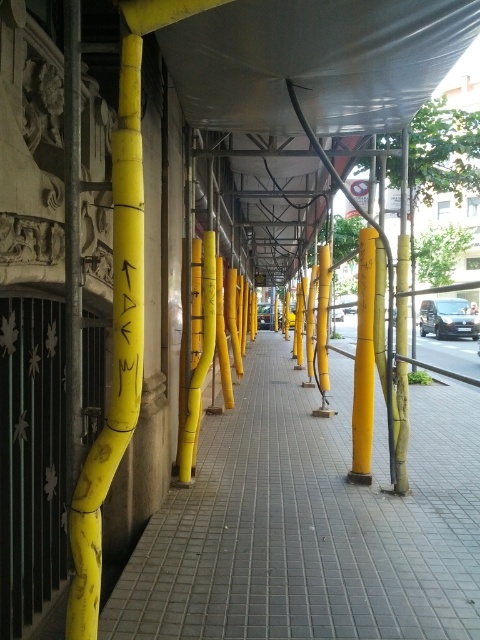
You are standing at the start of the walkway and see the yellow matte pole at center. If you walk straight towards it, how far will you have to walk to reach it?

You will have to walk 5.57 meters to reach the yellow matte pole at center.